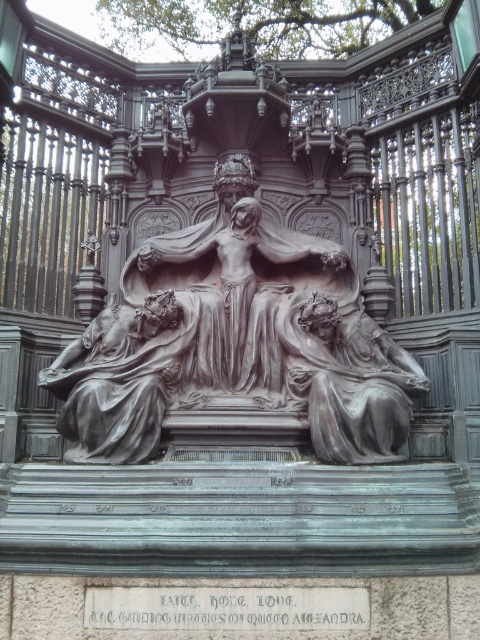
Find the location of a particular element. polished bronze sculpture at center is located at coordinates (235, 339).

Which of these two, polished bronze sculpture at center or matte bronze statue at center, stands shorter?

matte bronze statue at center is shorter.

The image size is (480, 640). Find the location of `polished bronze sculpture at center`. polished bronze sculpture at center is located at coordinates (235, 339).

Who is shorter, polished bronze statue at center or matte bronze statue at center?

Standing shorter between the two is matte bronze statue at center.

Which is more to the left, polished bronze statue at center or matte bronze statue at center?

polished bronze statue at center

Is point (127, 432) positioned after point (380, 378)?

No, (127, 432) is closer to viewer.

Find the location of a particular element. Image resolution: width=480 pixels, height=640 pixels. polished bronze statue at center is located at coordinates (120, 380).

Who is taller, polished bronze sculpture at center or polished bronze statue at center?

With more height is polished bronze sculpture at center.

Does polished bronze sculpture at center have a larger size compared to polished bronze statue at center?

Correct, polished bronze sculpture at center is larger in size than polished bronze statue at center.

Which is in front, point (147, 406) or point (91, 458)?

Positioned in front is point (91, 458).

Find the location of a particular element. The width and height of the screenshot is (480, 640). polished bronze sculpture at center is located at coordinates (235, 339).